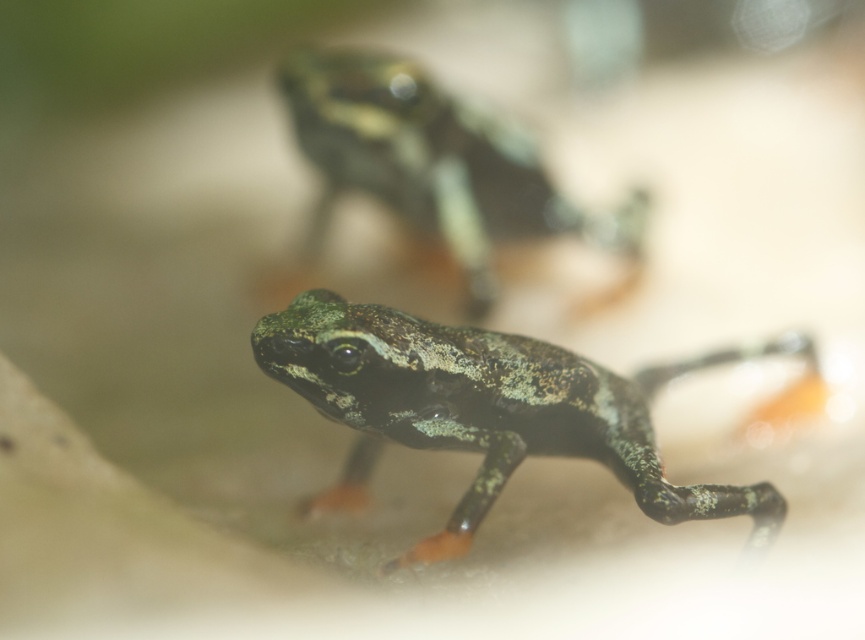
Does speckled green frog at center have a smaller size compared to speckled green skin at center?

Incorrect, speckled green frog at center is not smaller in size than speckled green skin at center.

Is speckled green frog at center above speckled green skin at center?

No, speckled green frog at center is not above speckled green skin at center.

Image resolution: width=865 pixels, height=640 pixels. I want to click on speckled green frog at center, so click(x=487, y=410).